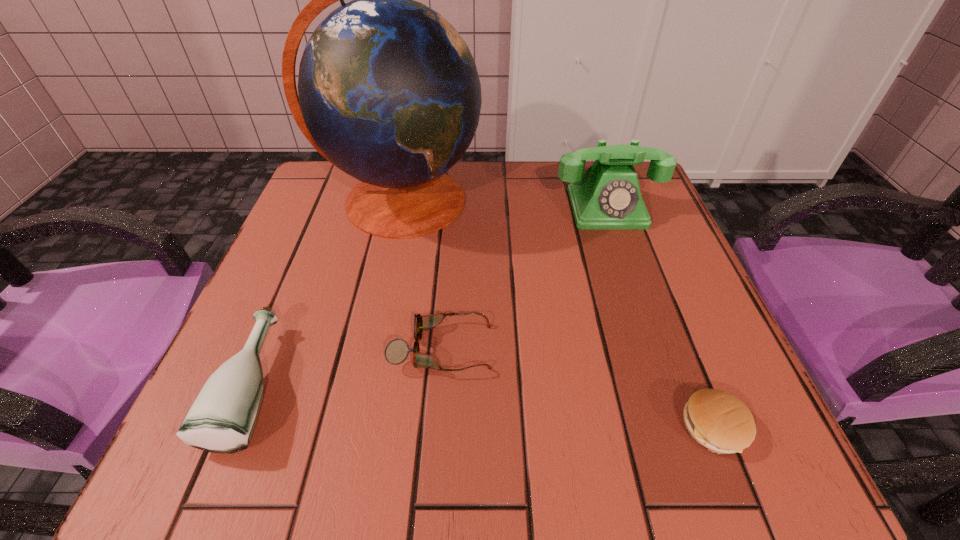
This screenshot has height=540, width=960. Find the location of `vacant space that satisfies the following two spatial constraints: 1. with the Americas facing the viewer on the tallest object; 2. on the left side of the patty`. vacant space that satisfies the following two spatial constraints: 1. with the Americas facing the viewer on the tallest object; 2. on the left side of the patty is located at coordinates (350, 427).

Where is `vacant space that satisfies the following two spatial constraints: 1. with the Americas facing the viewer on the patty; 2. on the left side of the tallest object`? Image resolution: width=960 pixels, height=540 pixels. vacant space that satisfies the following two spatial constraints: 1. with the Americas facing the viewer on the patty; 2. on the left side of the tallest object is located at coordinates (350, 427).

Locate an element on the screen. free space that satisfies the following two spatial constraints: 1. on the back side of the patty; 2. on the front-facing side of the spectacles is located at coordinates (683, 348).

The height and width of the screenshot is (540, 960). Find the location of `vacant region that satisfies the following two spatial constraints: 1. on the dial of the second tallest object; 2. on the right side of the patty`. vacant region that satisfies the following two spatial constraints: 1. on the dial of the second tallest object; 2. on the right side of the patty is located at coordinates (682, 427).